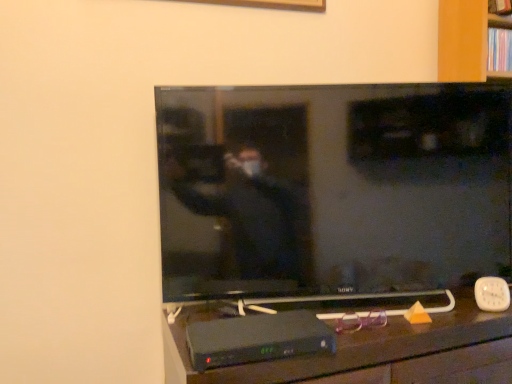
In order to face black plastic tv stand at lower center, should I rotate leftwards or rightwards?

Rotate your view right by about 11.635°.

Locate an element on the screen. The image size is (512, 384). wooden bookshelf at upper right is located at coordinates (500, 37).

Find the location of a particular element. This screenshot has width=512, height=384. black plastic tv stand at lower center is located at coordinates (338, 343).

There is a black plastic tv stand at lower center. Where is `television above it (from a real-world perspective)`? The width and height of the screenshot is (512, 384). television above it (from a real-world perspective) is located at coordinates (333, 188).

Between flat screen tv at center and black plastic tv stand at lower center, which one has smaller size?

With smaller size is flat screen tv at center.

Consider the image. Does flat screen tv at center touch black plastic tv stand at lower center?

They are not placed beside each other.

Relative to flat screen tv at center, is black plastic tv stand at lower center in front or behind?

Visually, black plastic tv stand at lower center is located in front of flat screen tv at center.

Is there a large distance between black plastic tv stand at lower center and flat screen tv at center?

No, there isn't a large distance between black plastic tv stand at lower center and flat screen tv at center.

Is flat screen tv at center located within black plastic tv stand at lower center?

No, flat screen tv at center is not surrounded by black plastic tv stand at lower center.

From the image's perspective, is wooden bookshelf at upper right beneath black plastic tv stand at lower center?

Incorrect, from the image's perspective, wooden bookshelf at upper right is higher than black plastic tv stand at lower center.

Consider the image. Is wooden bookshelf at upper right at the left side of black plastic tv stand at lower center?

No, wooden bookshelf at upper right is not to the left of black plastic tv stand at lower center.

At what (x,y) coordinates should I click in order to perform the action: click on shelf that is above the black plastic tv stand at lower center (from a real-world perspective). Please return your answer as a coordinate pair (x, y). The width and height of the screenshot is (512, 384). Looking at the image, I should click on (500, 37).

In the scene shown: Between wooden bookshelf at upper right and black plastic tv stand at lower center, which one has smaller size?

wooden bookshelf at upper right.

From the image's perspective, is black plastic tv stand at lower center positioned above or below wooden bookshelf at upper right?

Based on their image positions, black plastic tv stand at lower center is located beneath wooden bookshelf at upper right.

In terms of height, does black plastic tv stand at lower center look taller or shorter compared to wooden bookshelf at upper right?

Considering their sizes, black plastic tv stand at lower center has more height than wooden bookshelf at upper right.

Considering the sizes of objects black plastic tv stand at lower center and wooden bookshelf at upper right in the image provided, who is thinner, black plastic tv stand at lower center or wooden bookshelf at upper right?

Thinner between the two is wooden bookshelf at upper right.

Which is closer to the camera, (x=428, y=168) or (x=504, y=30)?

Point (x=428, y=168).

Which object is closer to the camera taking this photo, flat screen tv at center or wooden bookshelf at upper right?

Positioned in front is flat screen tv at center.

Which of these two, flat screen tv at center or wooden bookshelf at upper right, is wider?

With larger width is flat screen tv at center.

Which of these two, flat screen tv at center or wooden bookshelf at upper right, stands shorter?

With less height is wooden bookshelf at upper right.

Is wooden bookshelf at upper right inside or outside of flat screen tv at center?

wooden bookshelf at upper right is not inside flat screen tv at center, it's outside.

You are a GUI agent. You are given a task and a screenshot of the screen. Output one action in this format:
    pyautogui.click(x=<x>, y=<y>)
    Task: Click on the television in front of the wooden bookshelf at upper right
    
    Given the screenshot: What is the action you would take?
    pyautogui.click(x=333, y=188)

Is wooden bookshelf at upper right with flat screen tv at center?

There is a gap between wooden bookshelf at upper right and flat screen tv at center.

Locate an element on the screen. This screenshot has height=384, width=512. television that is behind the black plastic tv stand at lower center is located at coordinates (333, 188).

The image size is (512, 384). In the image, there is a flat screen tv at center. Identify the location of furniture below it (from the image's perspective). point(338,343).

When comparing their distances from wooden bookshelf at upper right, does black plastic tv stand at lower center or flat screen tv at center seem further?

Based on the image, black plastic tv stand at lower center appears to be further to wooden bookshelf at upper right.

Looking at the image, which one is located closer to black plastic tv stand at lower center, flat screen tv at center or wooden bookshelf at upper right?

flat screen tv at center.

Considering their positions, is flat screen tv at center positioned closer to wooden bookshelf at upper right than black plastic tv stand at lower center?

Among the two, flat screen tv at center is located nearer to wooden bookshelf at upper right.

Estimate the real-world distances between objects in this image. Which object is closer to black plastic tv stand at lower center, wooden bookshelf at upper right or flat screen tv at center?

Based on the image, flat screen tv at center appears to be nearer to black plastic tv stand at lower center.

Based on their spatial positions, is black plastic tv stand at lower center or wooden bookshelf at upper right further from flat screen tv at center?

Based on the image, wooden bookshelf at upper right appears to be further to flat screen tv at center.

Looking at the image, which one is located further to flat screen tv at center, wooden bookshelf at upper right or black plastic tv stand at lower center?

wooden bookshelf at upper right is positioned further to the anchor flat screen tv at center.

What are the coordinates of `television between wooden bookshelf at upper right and black plastic tv stand at lower center in the vertical direction` in the screenshot? It's located at (333, 188).